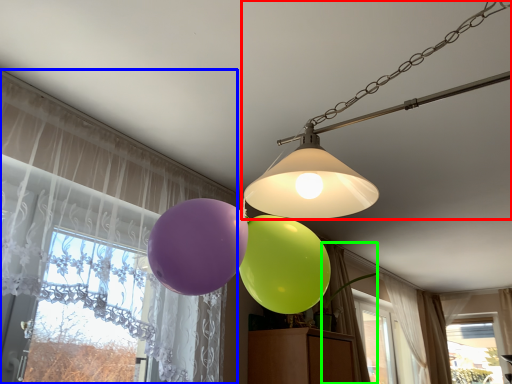
Question: Considering the real-world distances, which object is closest to lamp (highlighted by a red box)? curtain (highlighted by a blue box) or curtain (highlighted by a green box).

Choices:
 (A) curtain
 (B) curtain

Answer: (A)